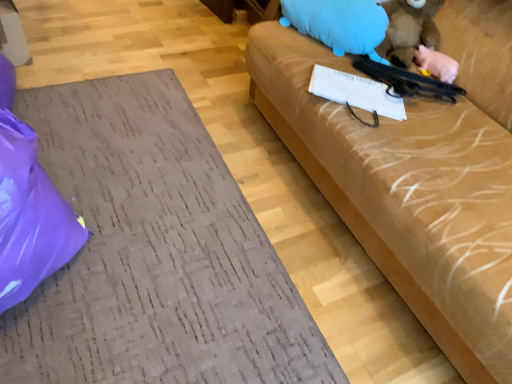
The width and height of the screenshot is (512, 384). I want to click on unoccupied region to the right of purple plastic bag at lower left, so click(156, 251).